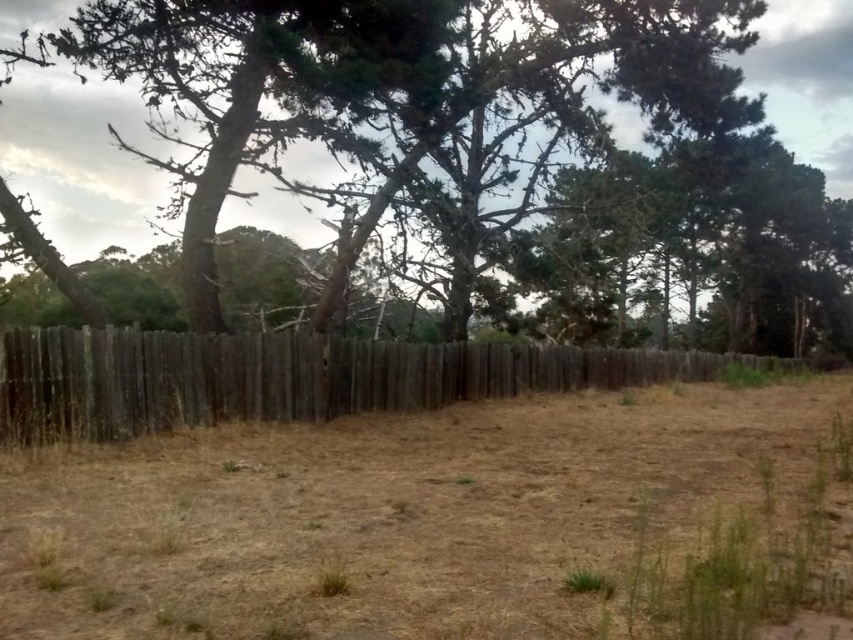
You are standing in the rural outdoor scene described. You notice a point marked at coordinates (289, 376). What does this point indicate?

The point at coordinates (289, 376) indicates the location of the weathered wood fence at center.

You are standing in the middle of the field in front of the wooden fence. There are two points marked on the ground in front of you. One is at point coordinates point (x=229, y=509) and the other is at point coordinates point (x=463, y=388). Which point is closer to you?

Point (x=229, y=509) is closer to the camera than point (x=463, y=388), so the point at coordinates point (x=229, y=509) is closer to you.

You are standing in the middle of the field looking at the brown dry soil at center and the weathered wood fence at center. Which object is positioned to the left?

The brown dry soil at center is to the left of the weathered wood fence at center.